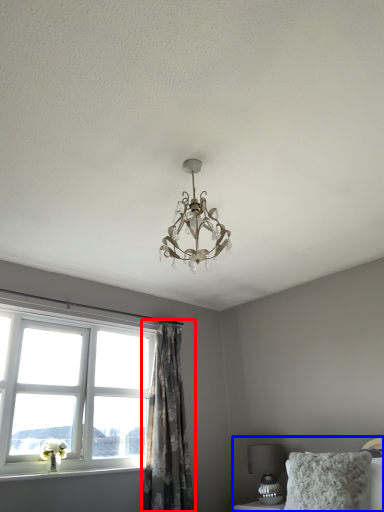
Question: Which object is further to the camera taking this photo, curtain (highlighted by a red box) or bed (highlighted by a blue box)?

Choices:
 (A) curtain
 (B) bed

Answer: (A)